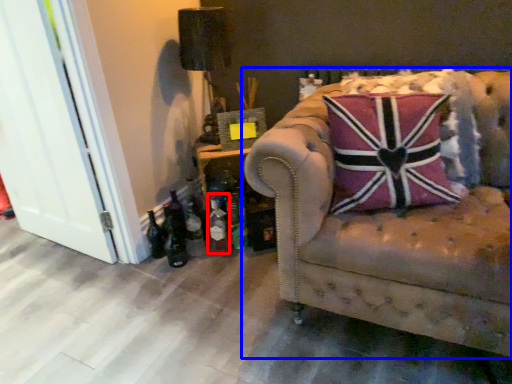
Question: Which point is further to the camera, bottle (highlighted by a red box) or studio couch (highlighted by a blue box)?

Choices:
 (A) bottle
 (B) studio couch

Answer: (A)